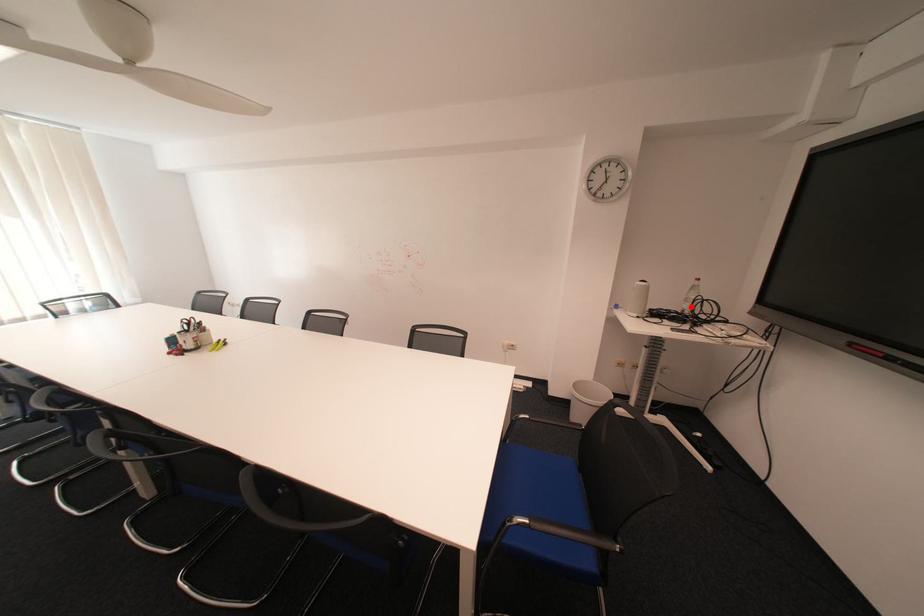
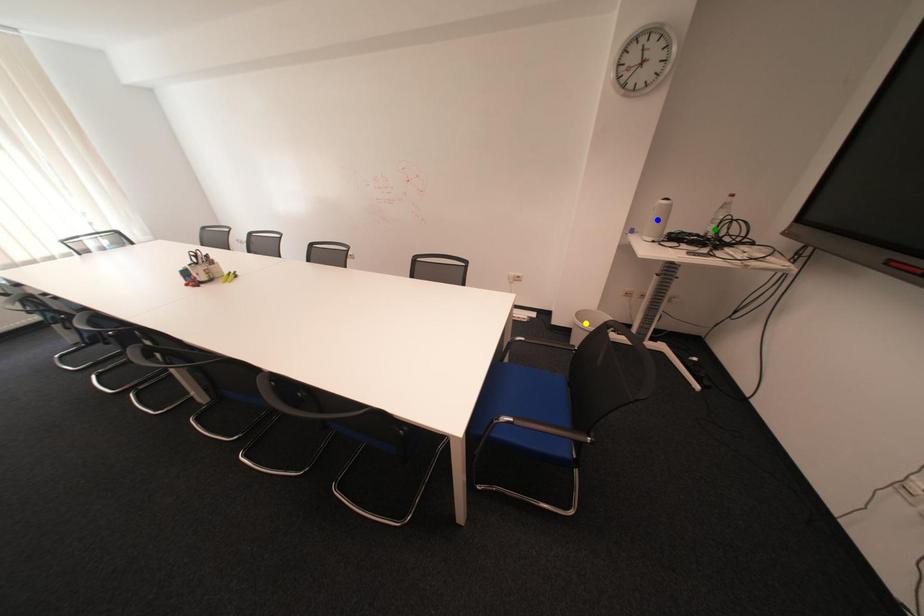
Question: I am providing you with two images of the same scene from different viewpoints. A red point is marked on the first image. You are given multiple points on the second image. In image 2, which mark is for the same physical point as the one in image 1?

Choices:
 (A) yellow point
 (B) green point
 (C) blue point

Answer: (B)